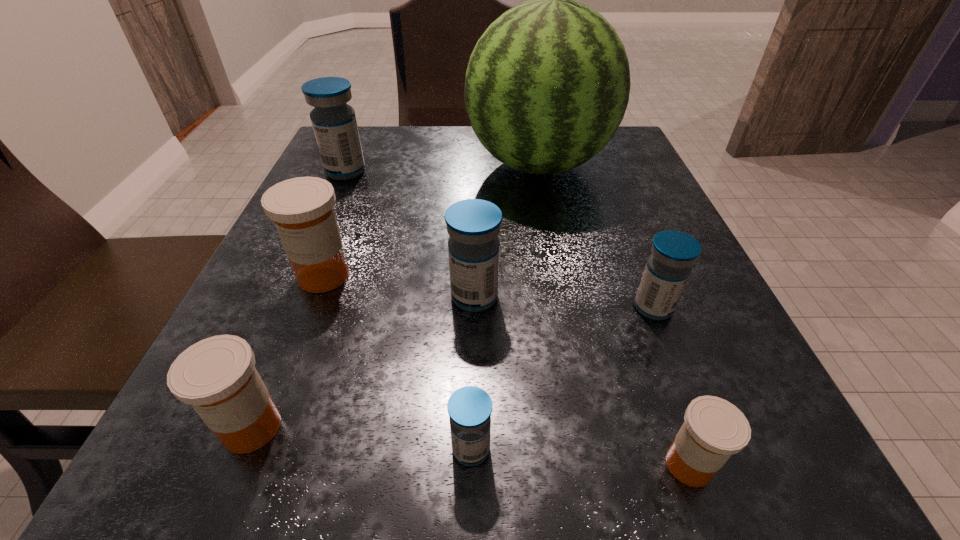
Locate an element on the screen. Image resolution: width=960 pixels, height=540 pixels. free space at the far left corner of the desktop is located at coordinates (383, 163).

This screenshot has height=540, width=960. Find the location of `vacant space at the near left corner`. vacant space at the near left corner is located at coordinates (203, 432).

Identify the location of free space at the far right corner of the desktop. The width and height of the screenshot is (960, 540). (606, 151).

Find the location of a particular element. Image resolution: width=960 pixels, height=540 pixels. empty location between the biggest orange medicine and the smallest blue medicine is located at coordinates (397, 362).

In order to click on free space between the watermelon and the smallest blue medicine in this screenshot , I will do (x=505, y=307).

The image size is (960, 540). I want to click on free spot between the biggest orange medicine and the nearest blue medicine, so click(x=397, y=362).

Find the location of a particular element. This screenshot has height=540, width=960. vacant area that lies between the second biggest blue medicine and the second smallest orange medicine is located at coordinates tap(363, 362).

Find the location of a particular element. free spot between the second biggest orange medicine and the biggest orange medicine is located at coordinates (288, 352).

The height and width of the screenshot is (540, 960). Find the location of `free area in between the second biggest orange medicine and the biggest orange medicine`. free area in between the second biggest orange medicine and the biggest orange medicine is located at coordinates (288, 352).

Identify the location of vacant space that is in between the green watermelon and the third biggest blue medicine. The image size is (960, 540). (596, 237).